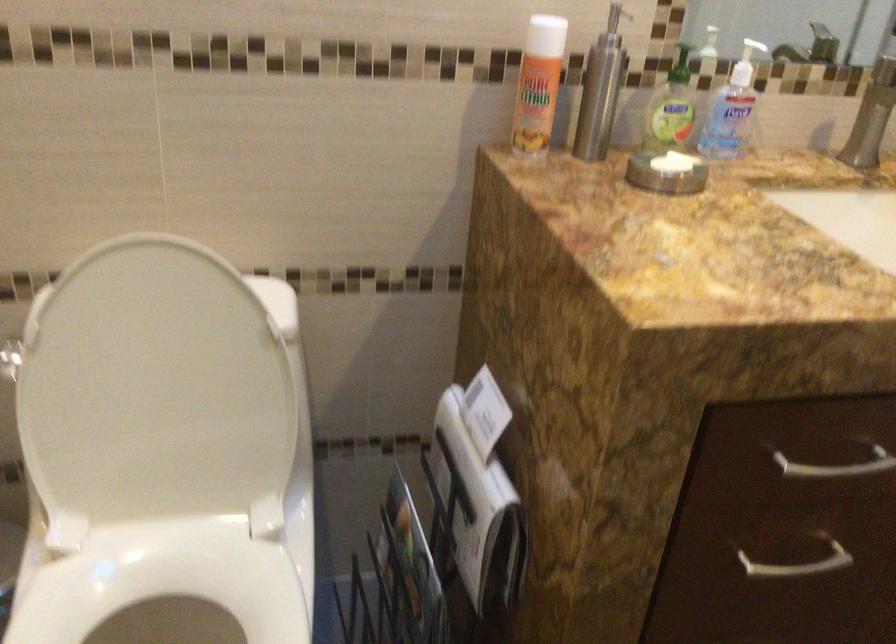
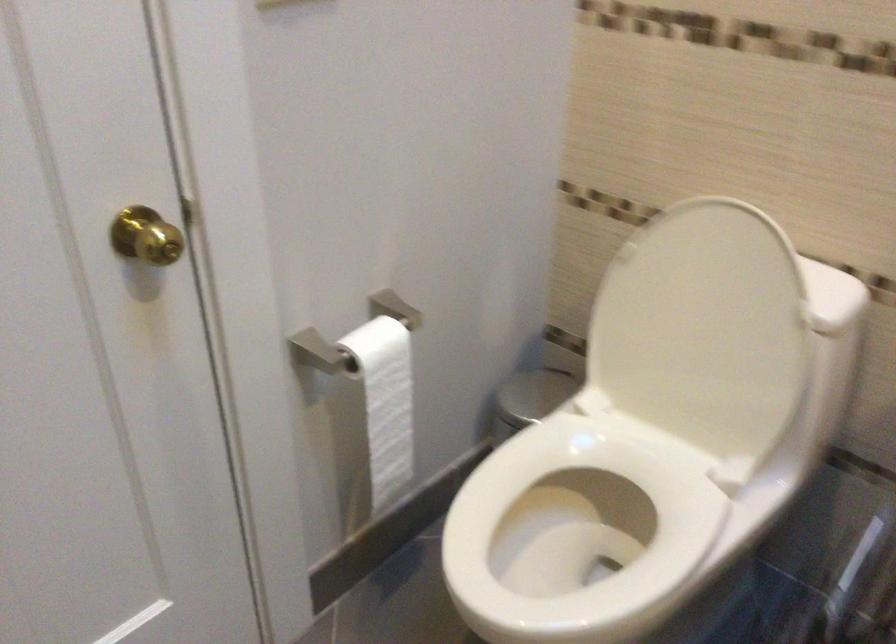
Find the pixel in the second image that matches point 168,390 in the first image.

(702, 330)